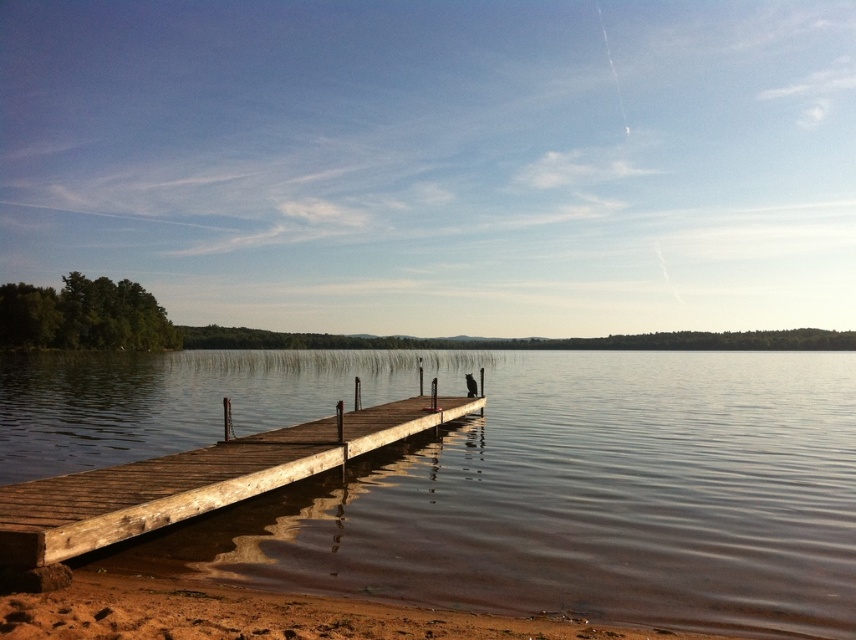
You are standing on the brown sandy beach at lower left and want to walk onto the wooden dock at center. Based on the scene description, how does the height difference between the two areas affect your ability to step onto the dock?

The wooden dock at center has a greater height compared to the brown sandy beach at lower left, so you will need to climb up a small step or ramp to get onto the dock.

You are standing on the wooden dock at center and want to step onto the brown wooden water at center. Is this possible? Why or why not?

The brown wooden water at center is taller than wooden dock at center, meaning it is elevated higher. Since water cannot support your weight, stepping onto it is impossible.

Looking at this image, you are planning to walk from the brown sandy beach at lower left to the brown wooden water at center. Considering the distance between them, do you think it would take more than 2 minutes if you walk at a normal pace?

The distance between brown wooden water at center and brown sandy beach at lower left is 130.02 feet. Walking at a normal pace of about 3 feet per second, it would take roughly 43 seconds, so it would not take more than 2 minutes.